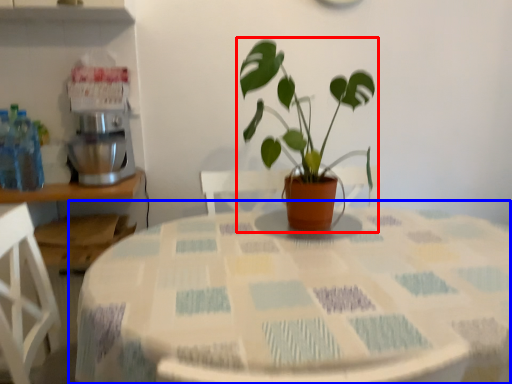
Question: Which object appears farthest to the camera in this image, houseplant (highlighted by a red box) or table (highlighted by a blue box)?

Choices:
 (A) houseplant
 (B) table

Answer: (A)